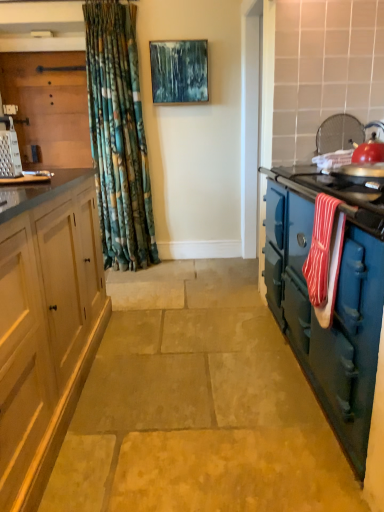
Question: From a real-world perspective, is blue cast iron stove at right, the first cabinetry from the bottom, positioned over textured canvas painting at upper center based on gravity?

Choices:
 (A) yes
 (B) no

Answer: (B)

Question: Is blue cast iron stove at right, the first cabinetry from the bottom, to the right of textured canvas painting at upper center from the viewer's perspective?

Choices:
 (A) yes
 (B) no

Answer: (A)

Question: Is blue cast iron stove at right, which is the 1th cabinetry in right-to-left order, at the left side of textured canvas painting at upper center?

Choices:
 (A) no
 (B) yes

Answer: (A)

Question: Is blue cast iron stove at right, the second cabinetry positioned from the top, bigger than textured canvas painting at upper center?

Choices:
 (A) no
 (B) yes

Answer: (B)

Question: Is blue cast iron stove at right, the second cabinetry positioned from the top, shorter than textured canvas painting at upper center?

Choices:
 (A) yes
 (B) no

Answer: (B)

Question: From the image's perspective, is blue cast iron stove at right, which appears as the 2th cabinetry when viewed from the left, located above textured canvas painting at upper center?

Choices:
 (A) no
 (B) yes

Answer: (A)

Question: Can we say textured canvas painting at upper center lies outside metallic silver grater at left?

Choices:
 (A) yes
 (B) no

Answer: (A)

Question: From a real-world perspective, is textured canvas painting at upper center under metallic silver grater at left?

Choices:
 (A) no
 (B) yes

Answer: (A)

Question: Does textured canvas painting at upper center turn towards metallic silver grater at left?

Choices:
 (A) no
 (B) yes

Answer: (B)

Question: Can you confirm if textured canvas painting at upper center is taller than metallic silver grater at left?

Choices:
 (A) no
 (B) yes

Answer: (B)

Question: Does textured canvas painting at upper center appear on the right side of metallic silver grater at left?

Choices:
 (A) yes
 (B) no

Answer: (A)

Question: Does textured canvas painting at upper center have a larger size compared to metallic silver grater at left?

Choices:
 (A) no
 (B) yes

Answer: (B)

Question: Could you tell me if red striped towel at right is facing brushed metal grater at left, which ranks as the second cabinetry in right-to-left order?

Choices:
 (A) yes
 (B) no

Answer: (B)